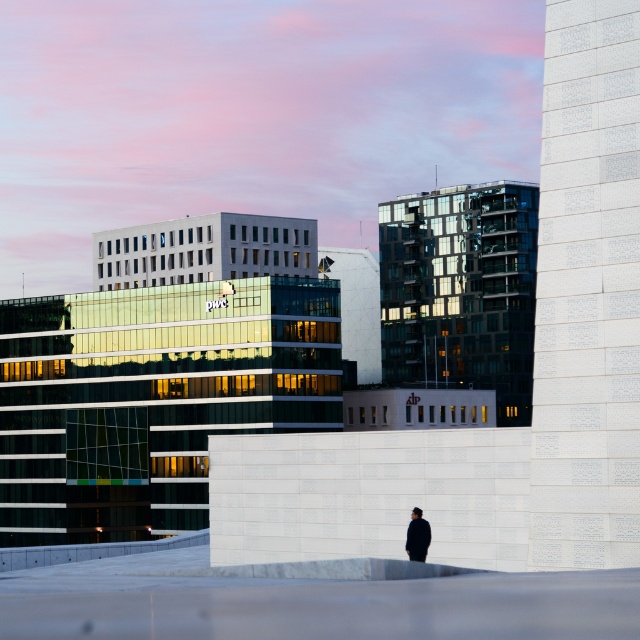
Question: Does white textured wall at right have a greater width compared to black matte jacket at center?

Choices:
 (A) yes
 (B) no

Answer: (A)

Question: Which point is farther to the camera?

Choices:
 (A) black matte jacket at center
 (B) white textured wall at right

Answer: (A)

Question: Does white textured wall at right appear on the left side of black matte jacket at center?

Choices:
 (A) no
 (B) yes

Answer: (A)

Question: Which of the following is the closest to the observer?

Choices:
 (A) white textured wall at right
 (B) black matte jacket at center

Answer: (A)

Question: Does white textured wall at right have a lesser width compared to black matte jacket at center?

Choices:
 (A) yes
 (B) no

Answer: (B)